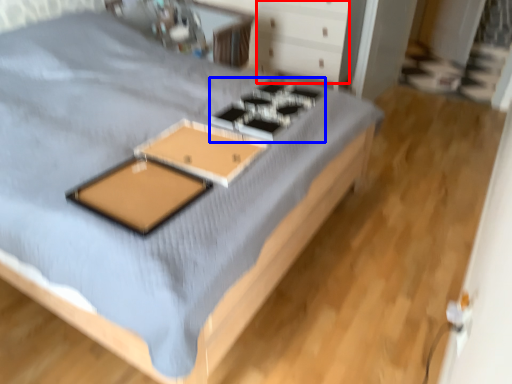
Question: Among these objects, which one is farthest to the camera, drawer (highlighted by a red box) or gas stove (highlighted by a blue box)?

Choices:
 (A) drawer
 (B) gas stove

Answer: (A)